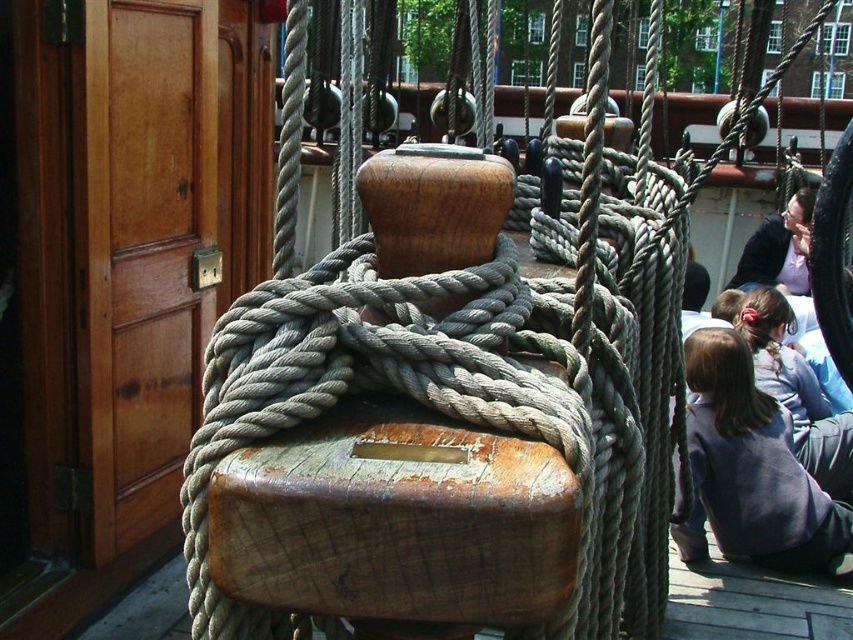
You are a sailor on the ship and you need to secure a rope to the cleat. You have a dark gray sweatshirt at lower right and light brown hair at lower right in your view. Which object is taller?

The dark gray sweatshirt at lower right is taller than the light brown hair at lower right.

Based on the photo, you are a sailor on the ship and need to secure a rope. You see two people on the deck, the light brown hair at lower right and dark hair at lower right. Which person is taller?

The light brown hair at lower right is taller than dark hair at lower right according to the description.

You are a sailor on the ship deck and you see the dark gray sweatshirt at lower right and the light brown hair at lower right. Which object is larger in size?

The dark gray sweatshirt at lower right is bigger than the light brown hair at lower right according to the description.